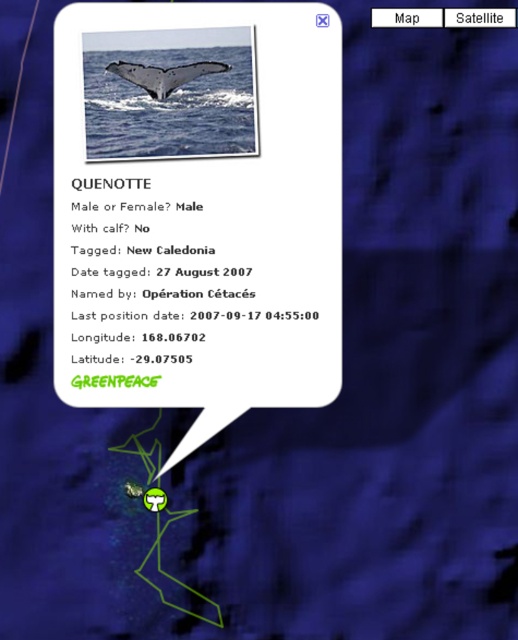
Question: Does blue water at tail right have a greater width compared to gray matte whale tail at upper center?

Choices:
 (A) yes
 (B) no

Answer: (A)

Question: Which point is closer to the camera?

Choices:
 (A) black paper text at upper center
 (B) blue water at tail right

Answer: (B)

Question: Which of the following is the closest to the observer?

Choices:
 (A) (134, 138)
 (B) (122, 246)

Answer: (A)

Question: Which point is farther to the camera?

Choices:
 (A) (244, 321)
 (B) (159, 70)
 (C) (227, 92)

Answer: (A)

Question: Does black paper text at upper center appear on the right side of blue water at tail right?

Choices:
 (A) no
 (B) yes

Answer: (B)

Question: Is blue water at tail right to the right of gray matte whale tail at upper center from the viewer's perspective?

Choices:
 (A) yes
 (B) no

Answer: (B)